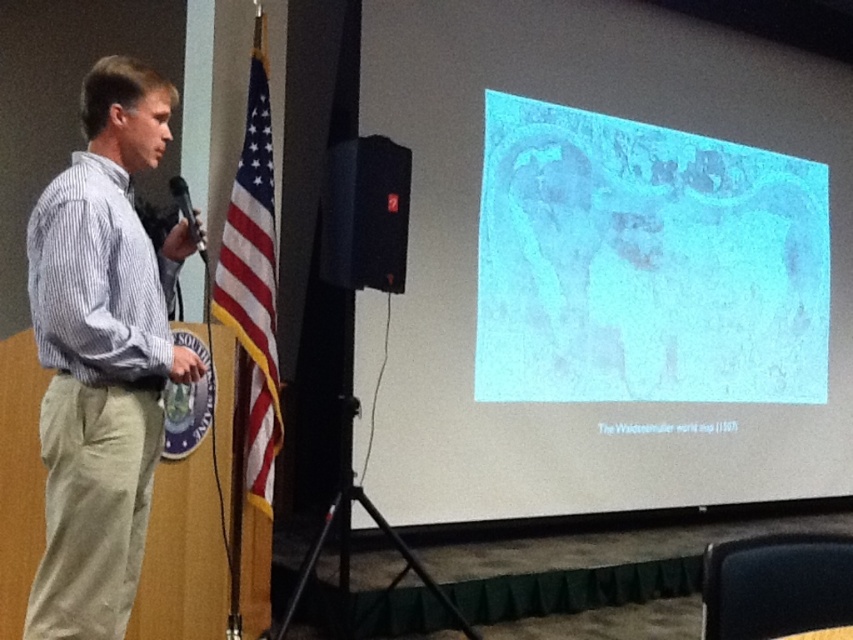
From the picture: You are an event planner organizing a conference. You need to place a new banner that is the same size as the blue translucent map at upper right. Can you determine if the banner will fit in the space where the striped cotton shirt at left is currently located?

The blue translucent map at upper right is larger than the striped cotton shirt at left. Since the banner is the same size as the blue translucent map at upper right, it will not fit in the space where the striped cotton shirt at left is located because it is larger.

You are standing in the conference room and want to take a photo of the podium. The camera you have can only focus on objects within 6 meters. Is the point at coordinates point (726, 292) within the camera focus range?

The point at coordinates point (726, 292) is 6.44 meters away from the camera, which is beyond the camera focus range of 6 meters. Therefore, the camera cannot focus on this point.

You are an event organizer planning to set up a presentation area. You have the blue translucent map at upper right and the american flag at left. Which object requires more horizontal space due to its width?

The blue translucent map at upper right requires more horizontal space because its width is larger than the american flag at left.